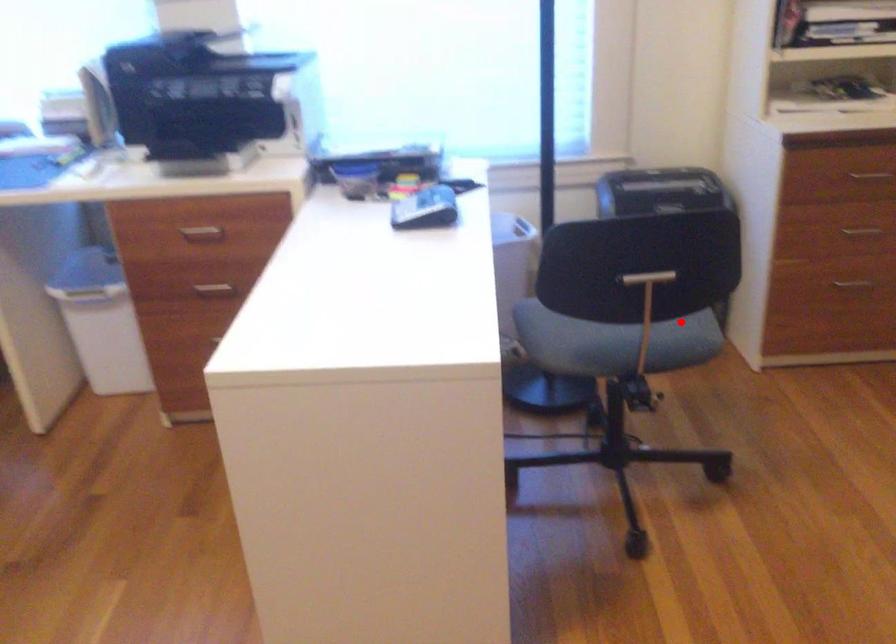
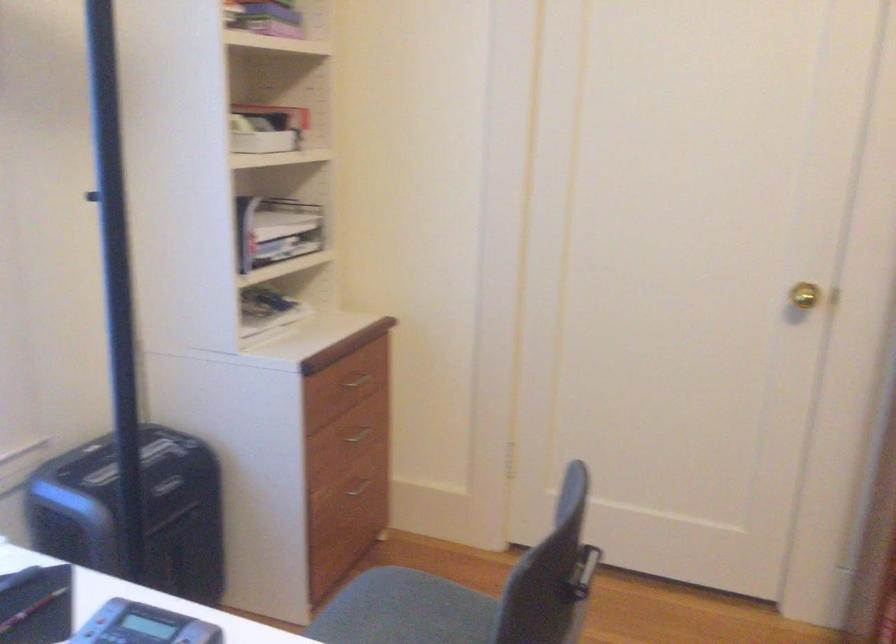
Locate, in the second image, the point that corresponds to the highlighted location in the first image.

(405, 611)